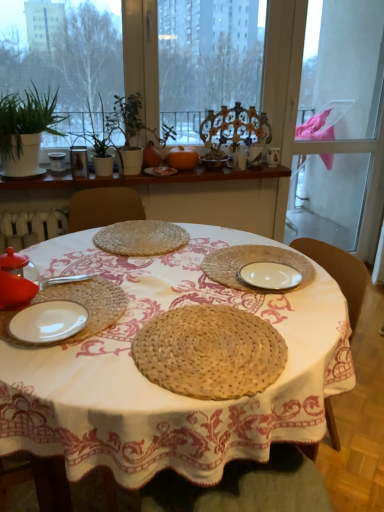
Locate an element on the screen. The image size is (384, 512). unoccupied area in front of white glossy plate at lower left, which appears as the 1th plate when ordered from the bottom is located at coordinates (54, 365).